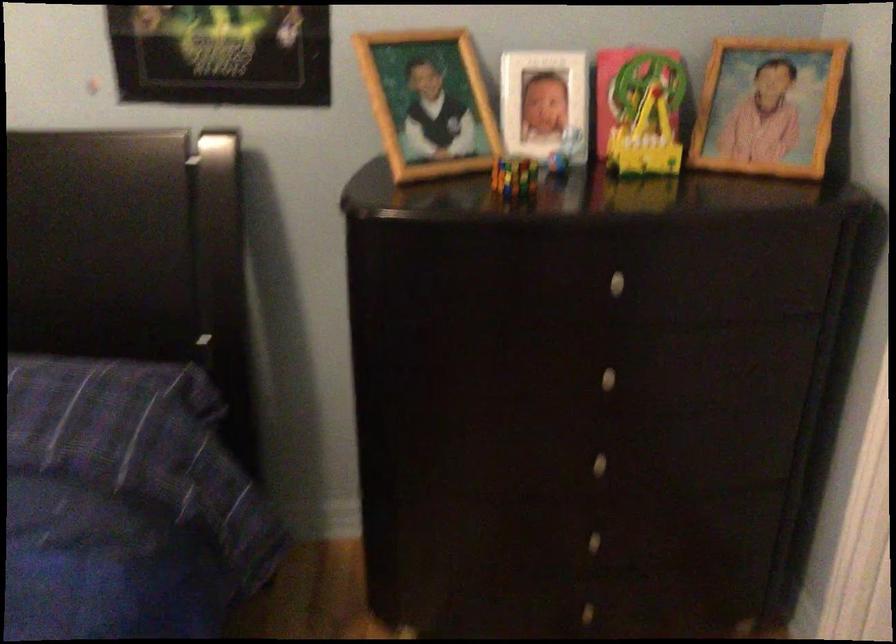
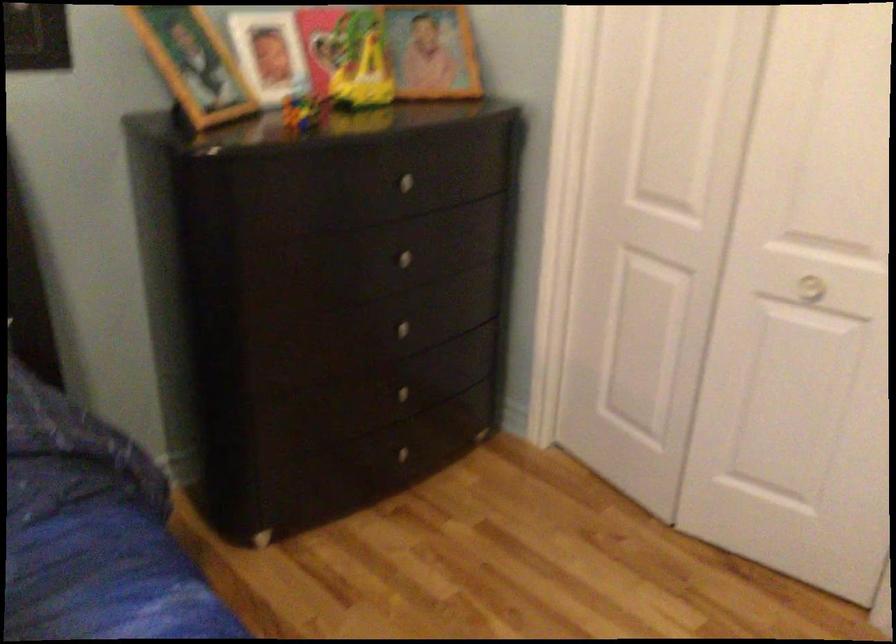
Where in the second image is the point corresponding to [622,276] from the first image?

(408, 178)